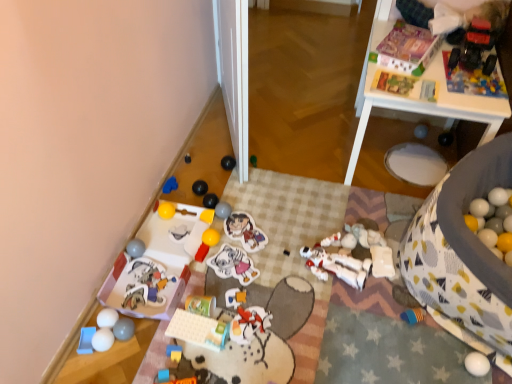
Locate an element on the screen. The image size is (512, 384). free area in between yellow matte ball at center, which appears as the thirteenth toy when viewed from the left, and white matte doll at center, acting as the 22th toy starting from the left is located at coordinates (264, 241).